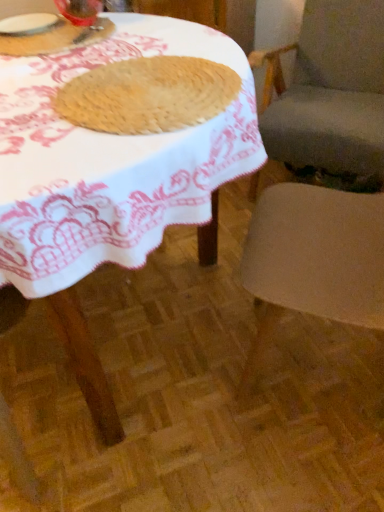
Identify the location of free location to the right of matte glass jar at upper left. (152, 36).